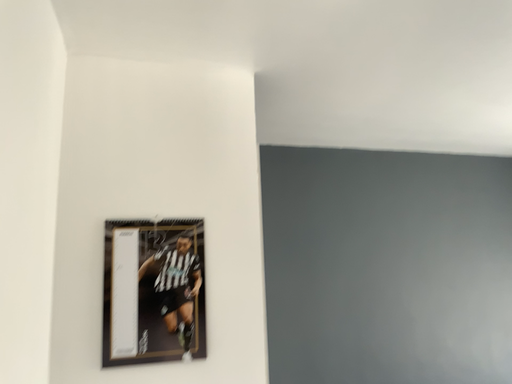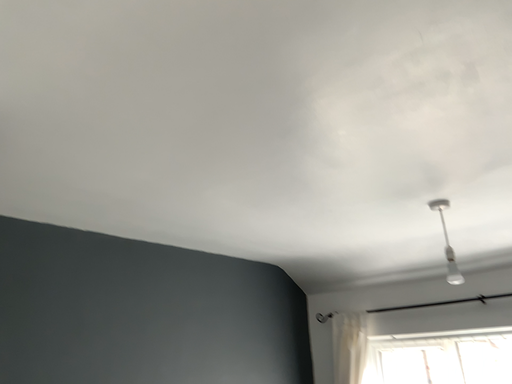
Question: Which way did the camera rotate in the video?

Choices:
 (A) rotated downward
 (B) rotated upward

Answer: (B)